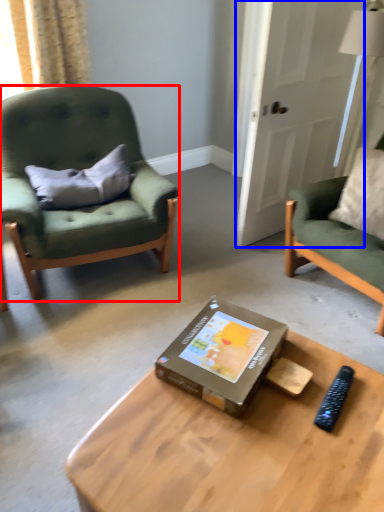
Question: Which object is further to the camera taking this photo, chair (highlighted by a red box) or glass door (highlighted by a blue box)?

Choices:
 (A) chair
 (B) glass door

Answer: (B)